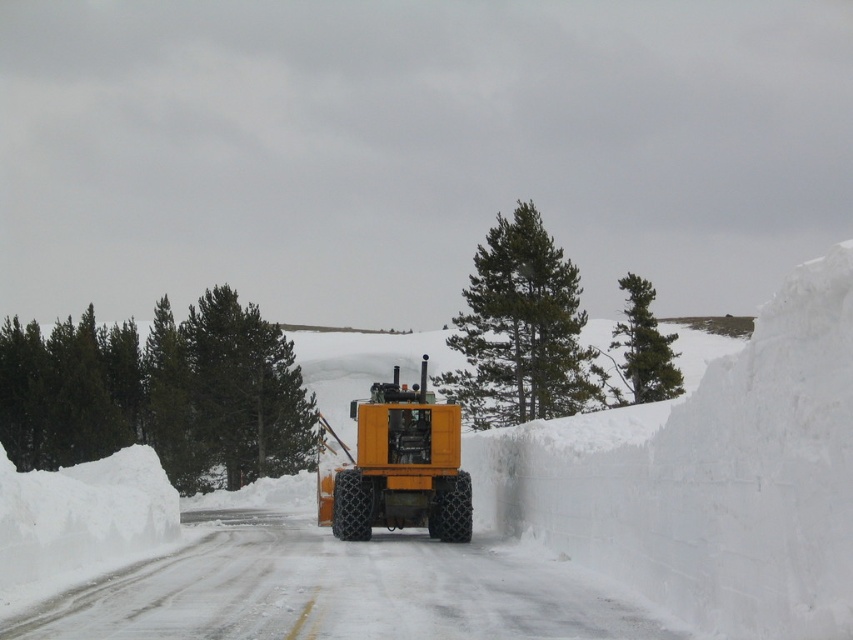
How far apart are white fluffy snow at center and green textured pine at upper right?

They are 24.87 meters apart.

Who is more forward, (364, 568) or (631, 317)?

Point (364, 568) is in front.

Who is more forward, (287, 504) or (669, 349)?

Point (287, 504)

The image size is (853, 640). Find the location of `white fluffy snow at center`. white fluffy snow at center is located at coordinates (506, 516).

Is white fluffy snow at center below green needle-like pine at center?

Yes, white fluffy snow at center is below green needle-like pine at center.

Which of these two, white fluffy snow at center or green needle-like pine at center, stands shorter?

Standing shorter between the two is white fluffy snow at center.

Who is more distant from viewer, (138, 605) or (508, 240)?

Point (508, 240)

Locate an element on the screen. The height and width of the screenshot is (640, 853). white fluffy snow at center is located at coordinates (506, 516).

Is green matte pine at left positioned in front of green needle-like pine at center?

That is False.

Who is more distant from viewer, (x=190, y=449) or (x=532, y=317)?

Positioned behind is point (x=190, y=449).

The image size is (853, 640). In order to click on green matte pine at left in this screenshot , I will do `click(158, 394)`.